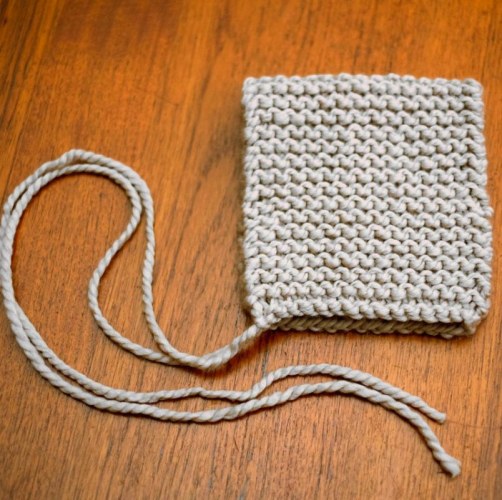
Image resolution: width=502 pixels, height=500 pixels. Identify the location of brown wooden floor seen on left side of handbag. (210, 200), (194, 228).